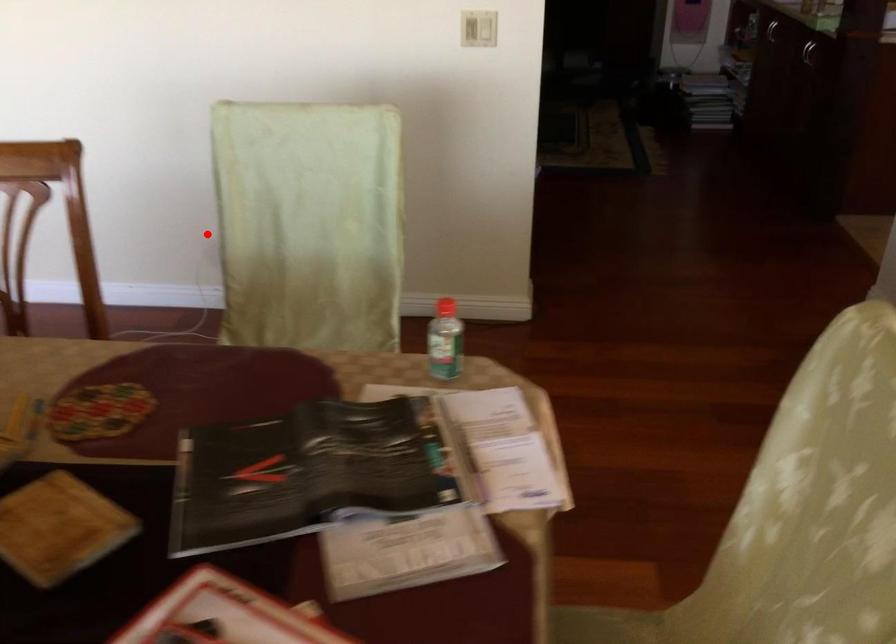
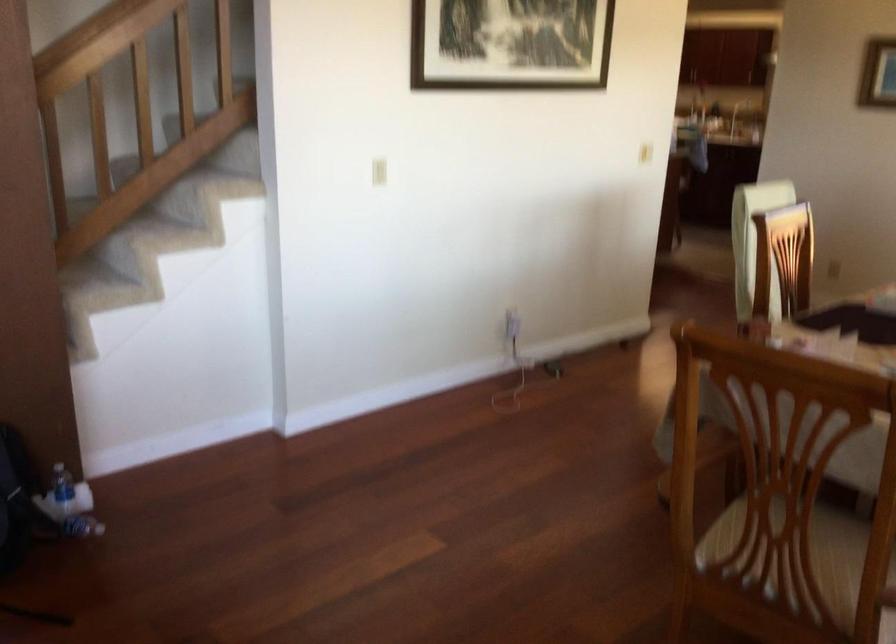
Question: I am providing you with two images of the same scene from different viewpoints. A red point is shown in image1. For the corresponding object point in image2, is it positioned nearer or farther from the camera?

Choices:
 (A) Nearer
 (B) Farther

Answer: (B)